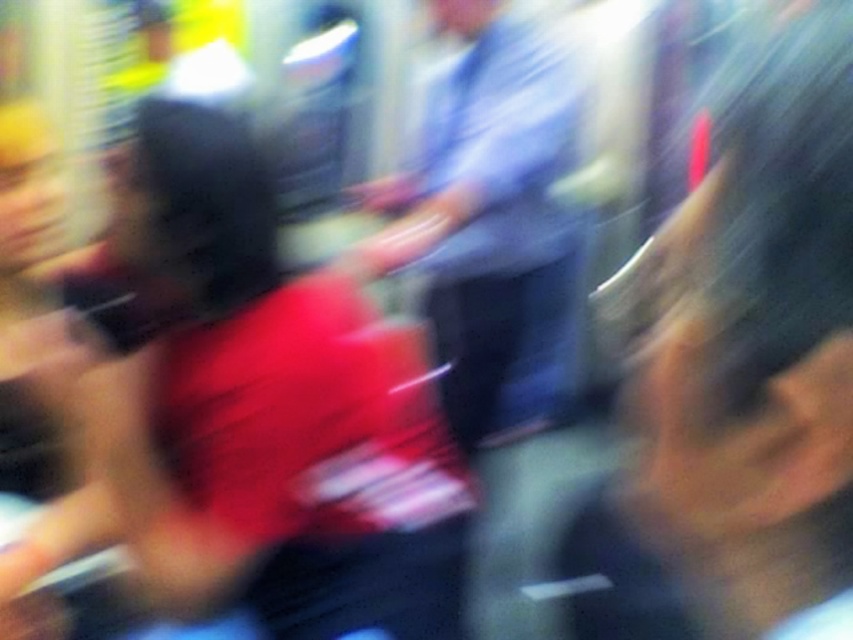
Which is above, matte red shirt at center or light blue shirt at center?

light blue shirt at center

I want to click on matte red shirt at center, so click(x=268, y=408).

The image size is (853, 640). I want to click on matte red shirt at center, so [268, 408].